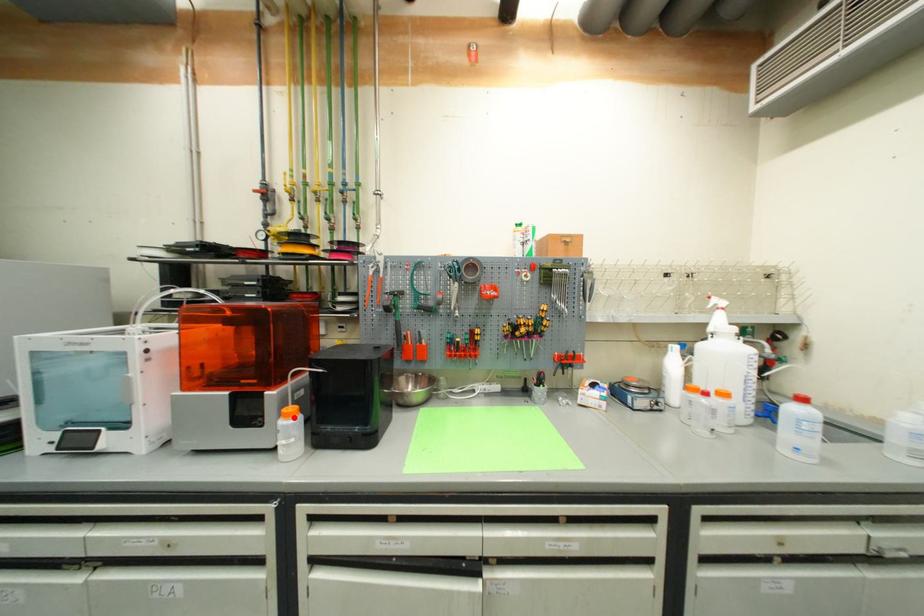
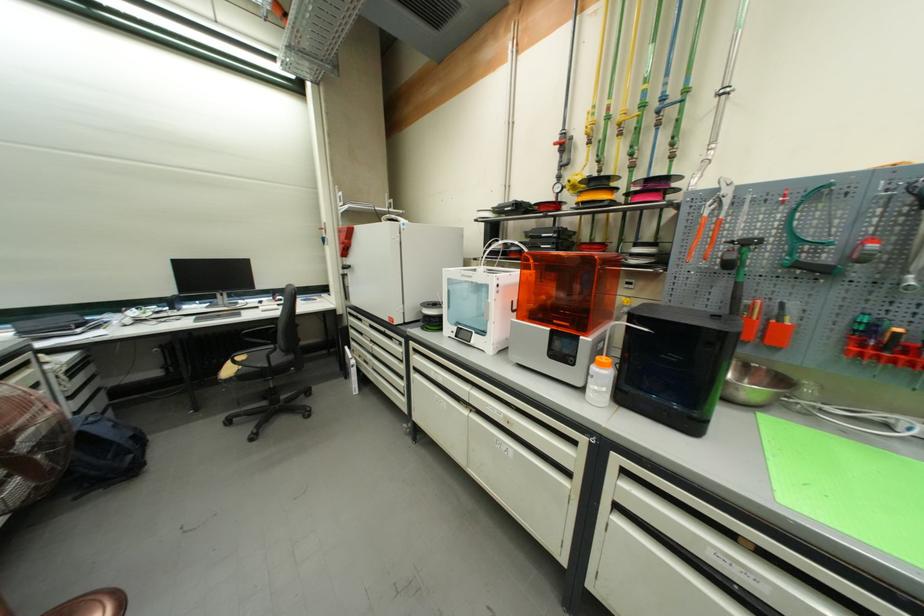
Question: I am providing you with two images of the same scene from different viewpoints. A red point is marked on the first image. Is the red point's position out of view in image 2?

Choices:
 (A) Yes
 (B) No

Answer: (B)